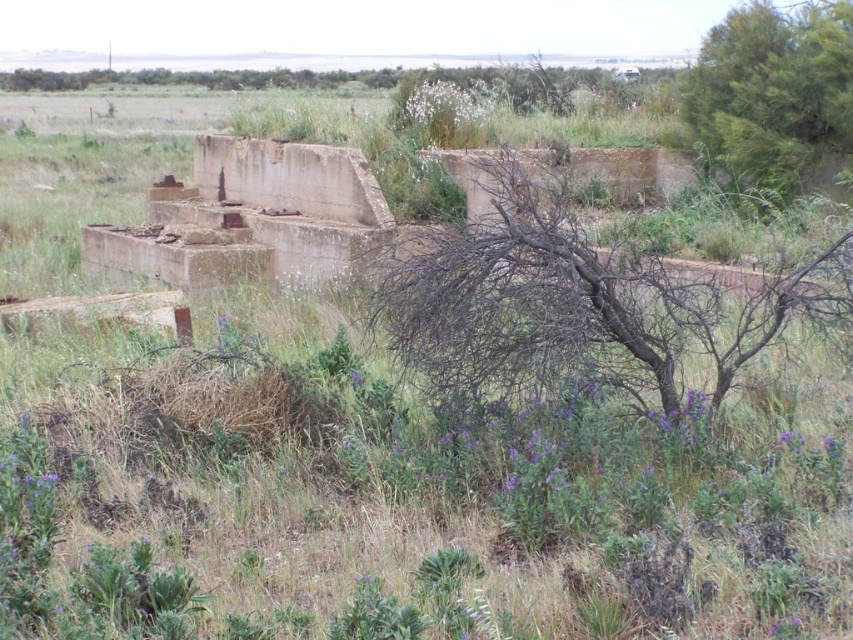
In the scene shown: You are a hiker lost in the wilderness and see the brown dry branches at center and the green leafy tree at upper right. Which object is closer to the ground?

The brown dry branches at center is closer to the ground because it is located below the green leafy tree at upper right.